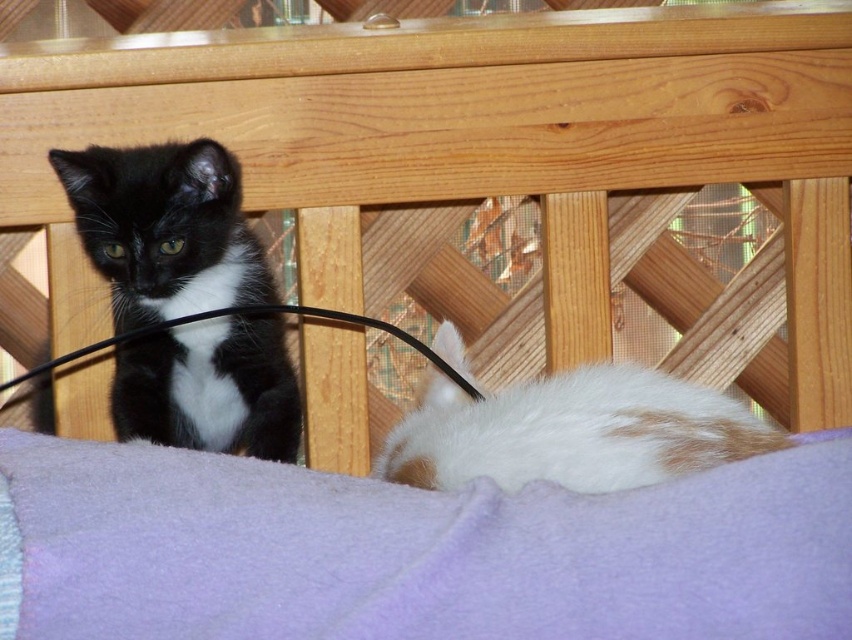
You are trying to place a small toy between the two kittens on the wooden bench. The purple fleece blanket at lower center is in the way. Can you move the blanket to the right to create space for the toy?

The purple fleece blanket at lower center is located at point (422, 552), so moving it to the right might create space between the kittens for the toy.

You are a photographer trying to capture both the purple fleece blanket at lower center and the white fur at lower right in a single shot. Based on their positions, which object should you focus on first to ensure both are in the frame?

The purple fleece blanket at lower center is located below the white fur at lower right. To include both in the frame, focus on the white fur at lower right first, then adjust the camera angle downward to include the purple fleece blanket at lower center below it.